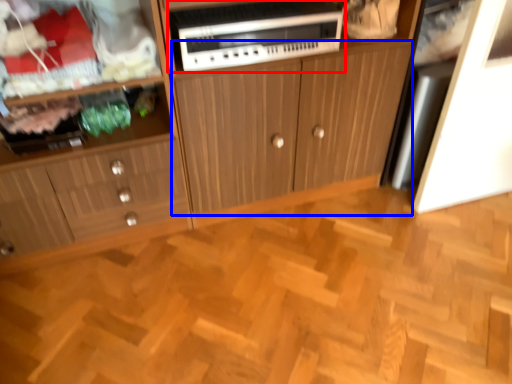
Question: Which of the following is the farthest to the observer, home appliance (highlighted by a red box) or cabinetry (highlighted by a blue box)?

Choices:
 (A) home appliance
 (B) cabinetry

Answer: (A)